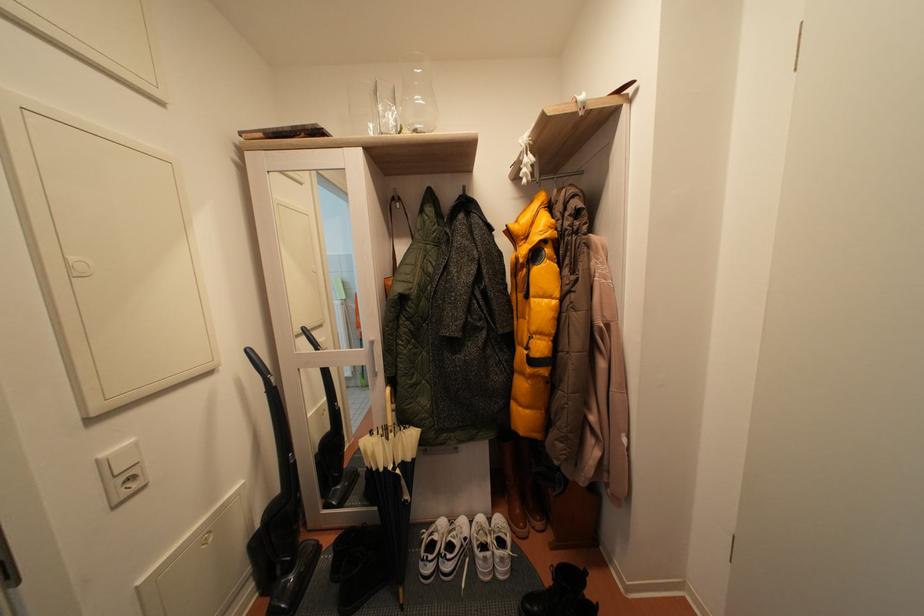
You are a GUI agent. You are given a task and a screenshot of the screen. Output one action in this format:
    pyautogui.click(x=<x>, y=<y>)
    Task: Click on the white plastic clip
    This screenshot has height=616, width=924.
    Given the screenshot: What is the action you would take?
    pyautogui.click(x=526, y=158)